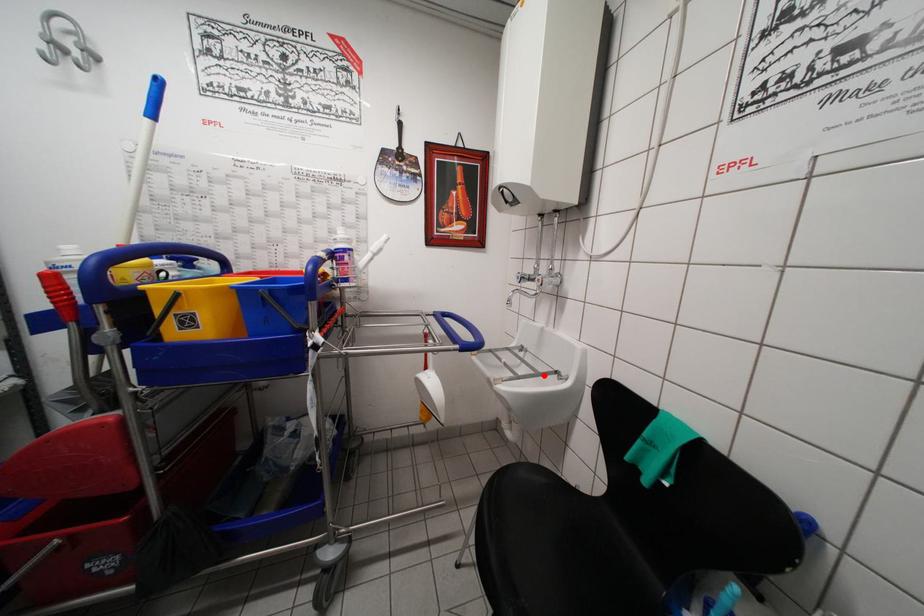
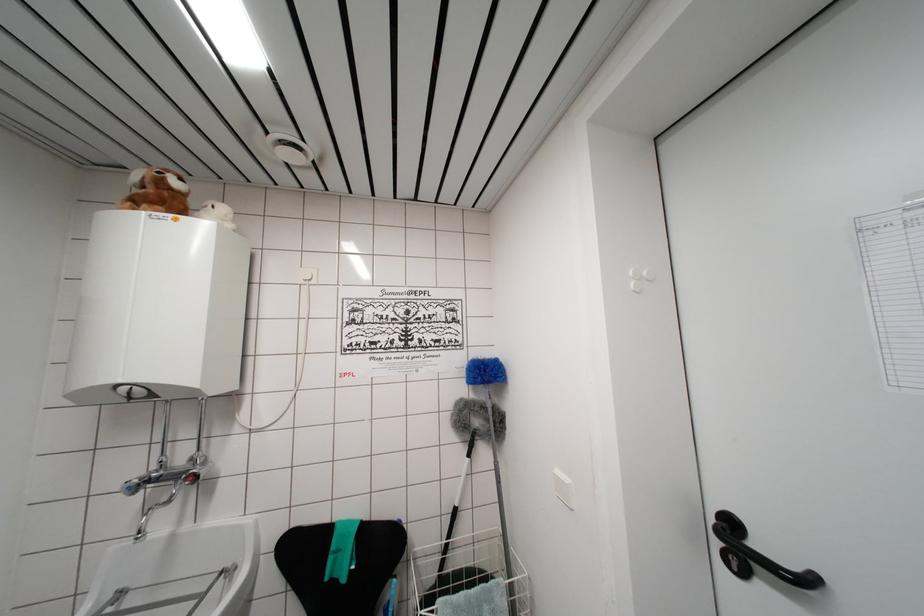
In the second image, find the point that corresponds to the highlighted location in the first image.

(209, 593)